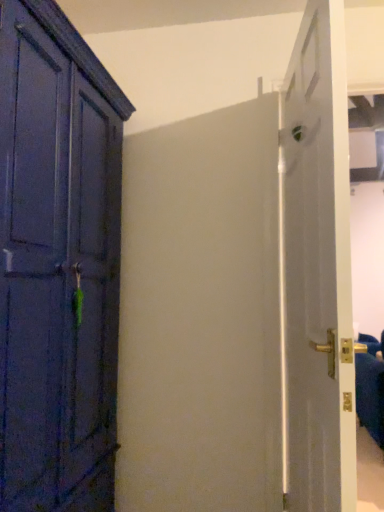
Describe the element at coordinates (317, 267) in the screenshot. This screenshot has height=512, width=384. I see `white glossy door at right` at that location.

Image resolution: width=384 pixels, height=512 pixels. What are the coordinates of `white glossy door at right` in the screenshot? It's located at (317, 267).

Image resolution: width=384 pixels, height=512 pixels. In order to click on gold metallic door handle at right in this screenshot , I will do `click(370, 388)`.

The width and height of the screenshot is (384, 512). What do you see at coordinates (370, 388) in the screenshot?
I see `gold metallic door handle at right` at bounding box center [370, 388].

Identify the location of white glossy door at right. Image resolution: width=384 pixels, height=512 pixels. (317, 267).

Consider the image. Which object is positioned more to the left, gold metallic door handle at right or white glossy door at right?

white glossy door at right is more to the left.

Between gold metallic door handle at right and white glossy door at right, which one is positioned in front?

white glossy door at right.

Which is less distant, [376,388] or [305,91]?

The point [305,91] is closer to the camera.

From the image's perspective, is gold metallic door handle at right positioned above or below white glossy door at right?

Clearly, from the image's perspective, gold metallic door handle at right is below white glossy door at right.

From a real-world perspective, is gold metallic door handle at right located beneath white glossy door at right?

Correct, in the physical world, gold metallic door handle at right is lower than white glossy door at right.

Considering the sizes of objects gold metallic door handle at right and white glossy door at right in the image provided, who is thinner, gold metallic door handle at right or white glossy door at right?

white glossy door at right is thinner.

Which of these two, gold metallic door handle at right or white glossy door at right, stands taller?

Answer: With more height is white glossy door at right.

Which of these two, gold metallic door handle at right or white glossy door at right, is smaller?

white glossy door at right is smaller.

Choose the correct answer: Is gold metallic door handle at right inside white glossy door at right or outside it?

gold metallic door handle at right is spatially situated outside white glossy door at right.

In the scene shown: Is gold metallic door handle at right far away from white glossy door at right?

That's right, there is a large distance between gold metallic door handle at right and white glossy door at right.

Is gold metallic door handle at right oriented towards white glossy door at right?

No, gold metallic door handle at right is not turned towards white glossy door at right.

How many degrees apart are the facing directions of gold metallic door handle at right and white glossy door at right?

There is a 82.1-degree angle between the facing directions of gold metallic door handle at right and white glossy door at right.

Locate an element on the screen. door on the left of gold metallic door handle at right is located at coordinates (317, 267).

Between white glossy door at right and gold metallic door handle at right, which one appears on the left side from the viewer's perspective?

From the viewer's perspective, white glossy door at right appears more on the left side.

Considering the positions of objects white glossy door at right and gold metallic door handle at right in the image provided, who is in front, white glossy door at right or gold metallic door handle at right?

white glossy door at right is closer to the camera.

Which is more distant, (301, 183) or (366, 420)?

Positioned behind is point (366, 420).

From the image's perspective, is white glossy door at right above gold metallic door handle at right?

Correct, white glossy door at right appears higher than gold metallic door handle at right in the image.

From a real-world perspective, relative to gold metallic door handle at right, is white glossy door at right vertically above or below?

white glossy door at right is situated higher than gold metallic door handle at right in the real world.

Considering the relative sizes of white glossy door at right and gold metallic door handle at right in the image provided, is white glossy door at right thinner than gold metallic door handle at right?

Yes.

Is white glossy door at right taller or shorter than gold metallic door handle at right?

Clearly, white glossy door at right is taller compared to gold metallic door handle at right.

Can you confirm if white glossy door at right is bigger than gold metallic door handle at right?

No.

Choose the correct answer: Is white glossy door at right inside gold metallic door handle at right or outside it?

white glossy door at right is spatially situated outside gold metallic door handle at right.

Would you consider white glossy door at right to be distant from gold metallic door handle at right?

Yes, white glossy door at right and gold metallic door handle at right are located far from each other.

Is white glossy door at right facing away from gold metallic door handle at right?

No.

How different are the orientations of white glossy door at right and gold metallic door handle at right in degrees?

There is a 82.1-degree angle between the facing directions of white glossy door at right and gold metallic door handle at right.

Find the location of a particular element. door above the gold metallic door handle at right (from a real-world perspective) is located at coordinates point(317,267).

Identify the location of furniture that appears on the right of white glossy door at right. (370, 388).

Locate an element on the screen. door located above the gold metallic door handle at right (from the image's perspective) is located at coordinates (317, 267).